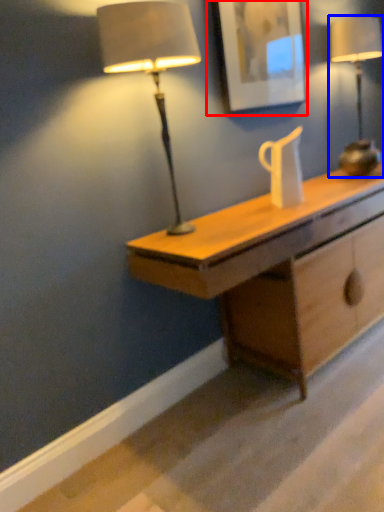
Question: Which of the following is the farthest to the observer, picture frame (highlighted by a red box) or lamp (highlighted by a blue box)?

Choices:
 (A) picture frame
 (B) lamp

Answer: (B)